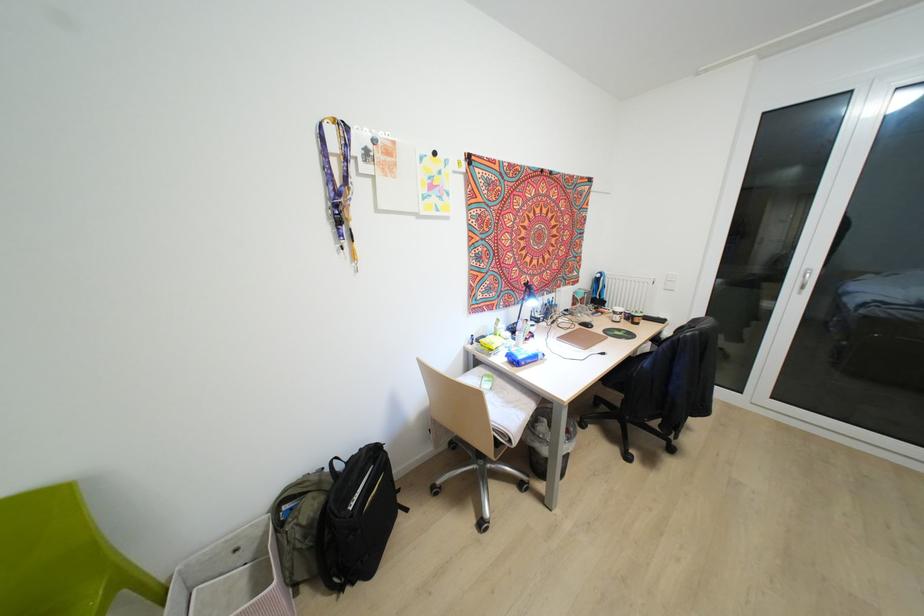
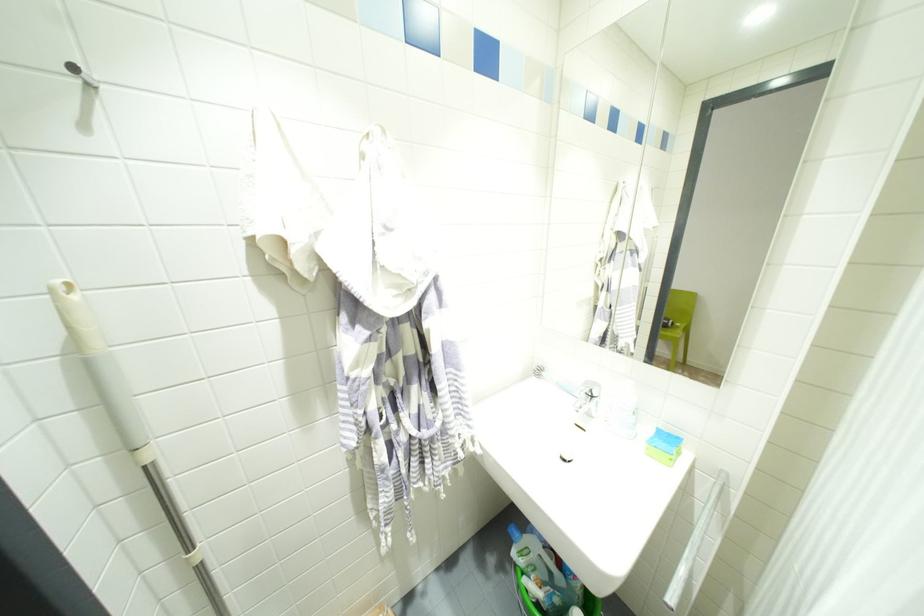
Question: I am providing you with two images of the same scene from different viewpoints. Please identify which objects are invisible in image2.

Choices:
 (A) black computer mouse
 (B) yellow paper sheet
 (C) green chair sitting surface
 (D) clear plastic cup

Answer: (A)